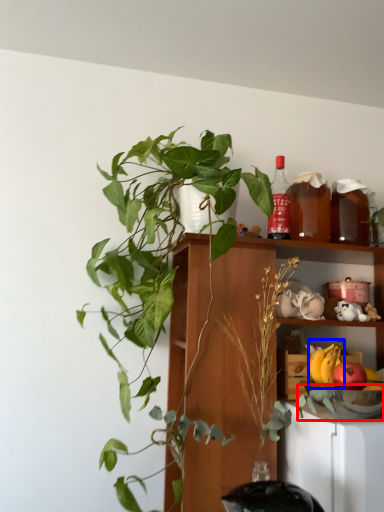
Question: Which object is closer to the camera taking this photo, glass bowl (highlighted by a red box) or banana (highlighted by a blue box)?

Choices:
 (A) glass bowl
 (B) banana

Answer: (A)